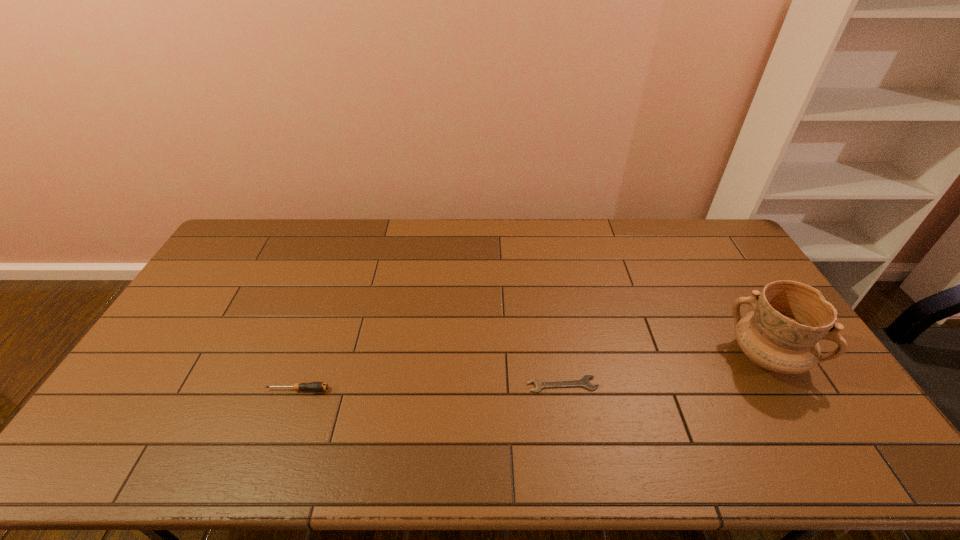
Identify the location of free space at the far edge. (349, 226).

The width and height of the screenshot is (960, 540). I want to click on free region at the left edge of the desktop, so click(225, 300).

Where is `vacant region at the right edge of the desktop`? This screenshot has width=960, height=540. vacant region at the right edge of the desktop is located at coordinates (775, 382).

In order to click on vacant position at the far left corner of the desktop in this screenshot , I will do `click(243, 229)`.

Where is `blank region between the leftmost object and the pottery`? blank region between the leftmost object and the pottery is located at coordinates (532, 373).

What are the coordinates of `vacant point located between the pottery and the leftmost object` in the screenshot? It's located at (532, 373).

You are a GUI agent. You are given a task and a screenshot of the screen. Output one action in this format:
    pyautogui.click(x=<x>, y=<y>)
    Task: Click on the free space between the pottery and the screwdriver
    This screenshot has width=960, height=540.
    Given the screenshot: What is the action you would take?
    coord(532,373)

Locate an element on the screen. empty space that is in between the second tallest object and the second object from left to right is located at coordinates (430, 387).

Image resolution: width=960 pixels, height=540 pixels. What are the coordinates of `empty space that is in between the second tallest object and the wrench` in the screenshot? It's located at (430, 387).

Locate an element on the screen. This screenshot has height=540, width=960. free space between the shortest object and the second tallest object is located at coordinates (430, 387).